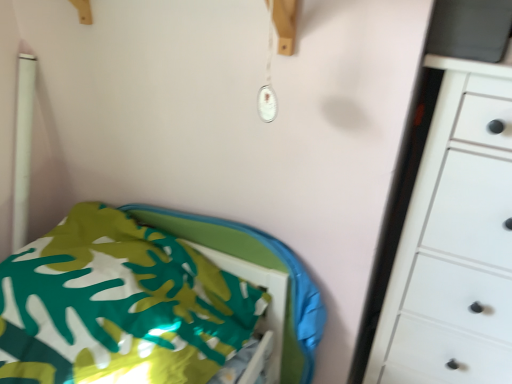
Question: From their relative heights in the image, would you say white matte chest of drawers at right is taller or shorter than green fabric bed at lower left?

Choices:
 (A) short
 (B) tall

Answer: (B)

Question: From a real-world perspective, is white matte chest of drawers at right positioned above or below green fabric bed at lower left?

Choices:
 (A) above
 (B) below

Answer: (A)

Question: From the image's perspective, is white matte chest of drawers at right positioned above or below green fabric bed at lower left?

Choices:
 (A) above
 (B) below

Answer: (A)

Question: Considering the positions of green fabric bed at lower left and white matte chest of drawers at right in the image, is green fabric bed at lower left wider or thinner than white matte chest of drawers at right?

Choices:
 (A) wide
 (B) thin

Answer: (A)

Question: Does point (189, 360) appear closer or farther from the camera than point (508, 175)?

Choices:
 (A) closer
 (B) farther

Answer: (B)

Question: Visually, is green fabric bed at lower left positioned to the left or to the right of white matte chest of drawers at right?

Choices:
 (A) left
 (B) right

Answer: (A)

Question: From a real-world perspective, relative to white matte chest of drawers at right, is green fabric bed at lower left vertically above or below?

Choices:
 (A) above
 (B) below

Answer: (B)